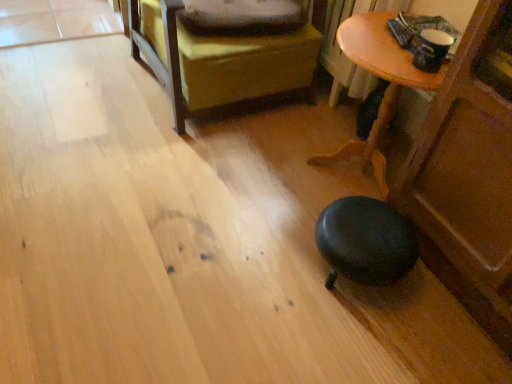
Question: From a real-world perspective, is wooden table at lower right over leather ottoman at center?

Choices:
 (A) yes
 (B) no

Answer: (B)

Question: Could you tell me if wooden table at lower right is facing leather ottoman at center?

Choices:
 (A) yes
 (B) no

Answer: (B)

Question: Considering the relative sizes of wooden table at lower right and leather ottoman at center in the image provided, is wooden table at lower right smaller than leather ottoman at center?

Choices:
 (A) yes
 (B) no

Answer: (A)

Question: Considering the relative sizes of wooden table at lower right and leather ottoman at center in the image provided, is wooden table at lower right wider than leather ottoman at center?

Choices:
 (A) no
 (B) yes

Answer: (A)

Question: Considering the relative sizes of wooden table at lower right and leather ottoman at center in the image provided, is wooden table at lower right thinner than leather ottoman at center?

Choices:
 (A) yes
 (B) no

Answer: (A)

Question: In terms of width, does soft gray pillow at upper center look wider or thinner when compared to leather ottoman at center?

Choices:
 (A) thin
 (B) wide

Answer: (A)

Question: From a real-world perspective, is soft gray pillow at upper center above or below leather ottoman at center?

Choices:
 (A) below
 (B) above

Answer: (B)

Question: From the image's perspective, is soft gray pillow at upper center located above or below leather ottoman at center?

Choices:
 (A) above
 (B) below

Answer: (B)

Question: Relative to leather ottoman at center, is soft gray pillow at upper center in front or behind?

Choices:
 (A) front
 (B) behind

Answer: (B)

Question: Considering the positions of point (424, 89) and point (285, 13), is point (424, 89) closer or farther from the camera than point (285, 13)?

Choices:
 (A) farther
 (B) closer

Answer: (B)

Question: From the image's perspective, relative to soft gray pillow at upper center, is wooden table at lower right above or below?

Choices:
 (A) below
 (B) above

Answer: (A)

Question: Choose the correct answer: Is wooden table at lower right inside soft gray pillow at upper center or outside it?

Choices:
 (A) outside
 (B) inside

Answer: (A)

Question: From a real-world perspective, is wooden table at lower right above or below soft gray pillow at upper center?

Choices:
 (A) above
 (B) below

Answer: (B)

Question: Is wooden table at lower right situated inside leather ottoman at center or outside?

Choices:
 (A) inside
 (B) outside

Answer: (B)

Question: Is point (394, 72) closer or farther from the camera than point (226, 18)?

Choices:
 (A) closer
 (B) farther

Answer: (A)